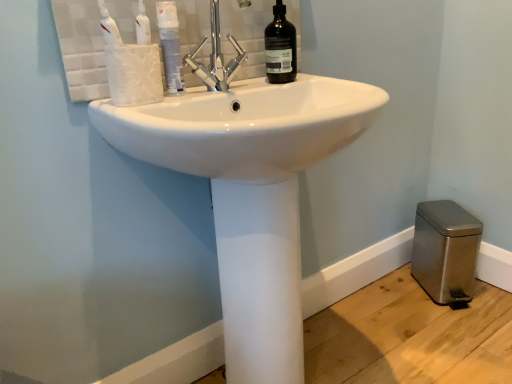
In order to face white glossy sink at center, should I rotate leftwards or rightwards?

Rotate right and turn 1.875 degrees.

Where is `chrome metallic faucet at upper center`? The width and height of the screenshot is (512, 384). chrome metallic faucet at upper center is located at coordinates (216, 57).

Considering the positions of point (295, 41) and point (249, 150), is point (295, 41) closer or farther from the camera than point (249, 150)?

Point (295, 41) is positioned farther from the camera compared to point (249, 150).

Does black glass bottle at upper center have a lesser width compared to white glossy sink at center?

Correct, the width of black glass bottle at upper center is less than that of white glossy sink at center.

Considering the relative positions of black glass bottle at upper center and white glossy sink at center in the image provided, is black glass bottle at upper center to the right of white glossy sink at center from the viewer's perspective?

Indeed, black glass bottle at upper center is positioned on the right side of white glossy sink at center.

Considering the sizes of objects black glass bottle at upper center and white glossy sink at center in the image provided, who is bigger, black glass bottle at upper center or white glossy sink at center?

white glossy sink at center.

Is chrome metallic faucet at upper center positioned with its back to white glossy sink at center?

No, chrome metallic faucet at upper center is not facing away from white glossy sink at center.

Is chrome metallic faucet at upper center not within white glossy sink at center?

chrome metallic faucet at upper center lies outside white glossy sink at center's area.

From a real-world perspective, who is located higher, chrome metallic faucet at upper center or white glossy sink at center?

From a 3D spatial view, chrome metallic faucet at upper center is above.

This screenshot has height=384, width=512. Identify the location of sink that is under the chrome metallic faucet at upper center (from a real-world perspective). (251, 193).

Based on the photo, could you tell me if chrome metallic faucet at upper center is turned towards black glass bottle at upper center?

No, chrome metallic faucet at upper center is not aimed at black glass bottle at upper center.

Does chrome metallic faucet at upper center lie behind black glass bottle at upper center?

No, chrome metallic faucet at upper center is closer to the camera.

Can you tell me how much chrome metallic faucet at upper center and black glass bottle at upper center differ in facing direction?

The facing directions of chrome metallic faucet at upper center and black glass bottle at upper center are 2.66 degrees apart.

Consider the image. Is chrome metallic faucet at upper center wider or thinner than black glass bottle at upper center?

Clearly, chrome metallic faucet at upper center has more width compared to black glass bottle at upper center.

From the image's perspective, does white glossy mouthwash at upper center appear lower than white glossy sink at center?

No, from the image's perspective, white glossy mouthwash at upper center is not below white glossy sink at center.

Is white glossy mouthwash at upper center not inside white glossy sink at center?

Yes, white glossy mouthwash at upper center is outside of white glossy sink at center.

Is white glossy mouthwash at upper center to the right of white glossy sink at center from the viewer's perspective?

No.

Does white glossy sink at center have a greater height compared to white glossy mouthwash at upper center?

Correct, white glossy sink at center is much taller as white glossy mouthwash at upper center.

Can you tell me how much white glossy sink at center and white glossy mouthwash at upper center differ in facing direction?

→ The angle between the facing direction of white glossy sink at center and the facing direction of white glossy mouthwash at upper center is 1.68 degrees.

Can you confirm if white glossy sink at center is positioned to the right of white glossy mouthwash at upper center?

Indeed, white glossy sink at center is positioned on the right side of white glossy mouthwash at upper center.

Who is smaller, white glossy sink at center or white glossy mouthwash at upper center?

white glossy mouthwash at upper center is smaller.

How different are the orientations of black glass bottle at upper center and chrome metallic faucet at upper center in degrees?

black glass bottle at upper center and chrome metallic faucet at upper center are facing 2.66 degrees away from each other.

In terms of height, does black glass bottle at upper center look taller or shorter compared to chrome metallic faucet at upper center?

Considering their sizes, black glass bottle at upper center has less height than chrome metallic faucet at upper center.

Can you confirm if black glass bottle at upper center is wider than chrome metallic faucet at upper center?

Incorrect, the width of black glass bottle at upper center does not surpass that of chrome metallic faucet at upper center.

Considering the positions of points (296, 53) and (219, 76), is point (296, 53) farther from camera compared to point (219, 76)?

Yes.

Identify the location of mouthwash that appears in front of the black glass bottle at upper center. (170, 46).

Is white glossy mouthwash at upper center facing towards black glass bottle at upper center?

No, white glossy mouthwash at upper center is not facing towards black glass bottle at upper center.

Consider the image. Can you confirm if white glossy mouthwash at upper center is positioned to the right of black glass bottle at upper center?

Incorrect, white glossy mouthwash at upper center is not on the right side of black glass bottle at upper center.

From a real-world perspective, does white glossy mouthwash at upper center sit lower than black glass bottle at upper center?

Indeed, from a real-world perspective, white glossy mouthwash at upper center is positioned beneath black glass bottle at upper center.

Where is `sink in front of the black glass bottle at upper center`? sink in front of the black glass bottle at upper center is located at coordinates click(x=251, y=193).

Identify the location of tap that appears behind the white glossy sink at center. (216, 57).

From the image, which object appears to be farther from white glossy mouthwash at upper center, chrome metallic faucet at upper center or white glossy sink at center?

The object further to white glossy mouthwash at upper center is white glossy sink at center.

When comparing their distances from chrome metallic faucet at upper center, does white glossy mouthwash at upper center or white glossy sink at center seem further?

white glossy sink at center is further to chrome metallic faucet at upper center.

Estimate the real-world distances between objects in this image. Which object is closer to black glass bottle at upper center, white glossy mouthwash at upper center or white glossy sink at center?

white glossy mouthwash at upper center lies closer to black glass bottle at upper center than the other object.

Which object lies nearer to the anchor point black glass bottle at upper center, white glossy sink at center or chrome metallic faucet at upper center?

chrome metallic faucet at upper center is closer to black glass bottle at upper center.

Estimate the real-world distances between objects in this image. Which object is closer to white glossy mouthwash at upper center, white glossy sink at center or black glass bottle at upper center?

Based on the image, black glass bottle at upper center appears to be nearer to white glossy mouthwash at upper center.

When comparing their distances from black glass bottle at upper center, does white glossy sink at center or white glossy mouthwash at upper center seem further?

white glossy sink at center is positioned further to the anchor black glass bottle at upper center.

Based on their spatial positions, is chrome metallic faucet at upper center or white glossy mouthwash at upper center closer to white glossy sink at center?

chrome metallic faucet at upper center is positioned closer to the anchor white glossy sink at center.

Considering their positions, is white glossy sink at center positioned further to white glossy mouthwash at upper center than chrome metallic faucet at upper center?

white glossy sink at center lies further to white glossy mouthwash at upper center than the other object.

Locate an element on the screen. Image resolution: width=512 pixels, height=384 pixels. mouthwash that lies between black glass bottle at upper center and white glossy sink at center from top to bottom is located at coordinates (170, 46).

This screenshot has width=512, height=384. Find the location of `tap between white glossy mouthwash at upper center and black glass bottle at upper center`. tap between white glossy mouthwash at upper center and black glass bottle at upper center is located at coordinates (216, 57).

Identify the location of mouthwash that lies between chrome metallic faucet at upper center and white glossy sink at center from top to bottom. (170, 46).

You are a GUI agent. You are given a task and a screenshot of the screen. Output one action in this format:
    pyautogui.click(x=<x>, y=<y>)
    Task: Click on the tap between black glass bottle at upper center and white glossy sink at center from top to bottom
    This screenshot has width=512, height=384.
    Given the screenshot: What is the action you would take?
    pyautogui.click(x=216, y=57)